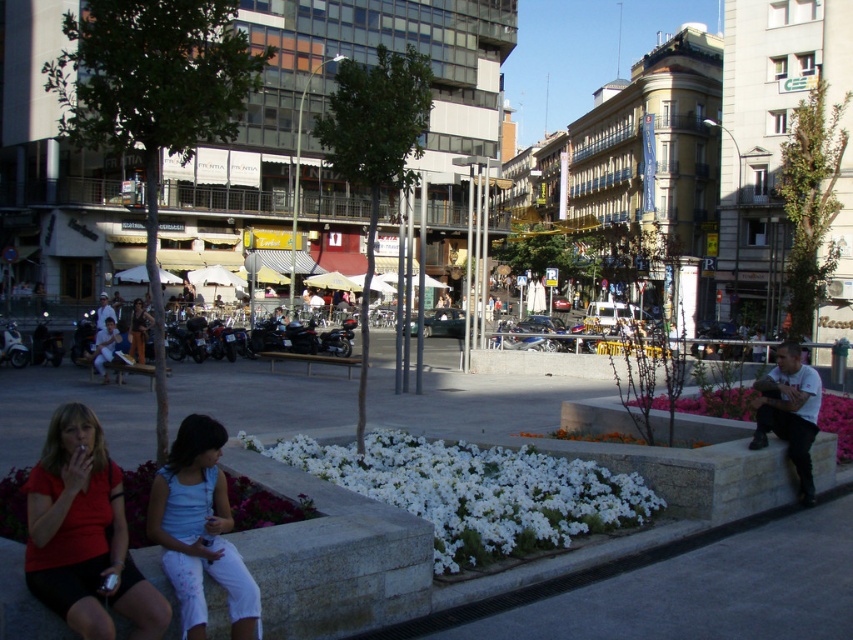
You are standing at the entrance of the plaza and want to find the light blue fabric pants at lower center. Based on the coordinates provided, in which direction should you walk to locate them?

The light blue fabric pants at lower center are located at coordinates point (200, 531). Since the x and y coordinates are both above 0.5, you should walk towards the lower right direction to locate them.

You are standing at the point marked by the coordinates (200, 531) in the urban plaza scene. Looking around, you see a low stone wall with flowers and two people sitting on it. Which direction should you walk to reach the light blue fabric pants at lower center?

The light blue fabric pants at lower center is represented by the point (200, 531), which is your current location. You are already at the position of the light blue fabric pants at lower center.

You are a photographer trying to capture the light blue fabric pants at lower center and the pink fabric flower at lower right in the same frame. Based on their positions, which object should you focus on first to ensure both are in the frame?

The light blue fabric pants at lower center should be focused on first since it is positioned below the pink fabric flower at lower right, allowing the photographer to adjust the frame to include both objects.